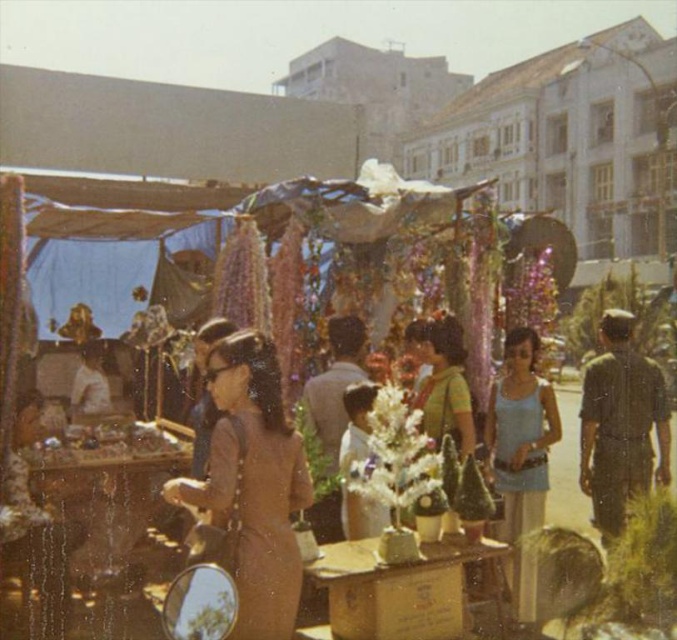
Can you confirm if dark green uniform at right is positioned to the left of green textured blouse at center?

In fact, dark green uniform at right is to the right of green textured blouse at center.

Which is behind, point (588, 461) or point (447, 428)?

The point (588, 461) is behind.

At what (x,y) coordinates should I click in order to perform the action: click on dark green uniform at right. Please return your answer as a coordinate pair (x, y). This screenshot has height=640, width=677. Looking at the image, I should click on [619, 424].

Which of these two, brown matte dress at center or green textured blouse at center, stands shorter?

With less height is green textured blouse at center.

Describe the element at coordinates (253, 483) in the screenshot. The image size is (677, 640). I see `brown matte dress at center` at that location.

Identify the location of brown matte dress at center. (253, 483).

Does dark green uniform at right have a lesser width compared to light blue tank top at center?

In fact, dark green uniform at right might be wider than light blue tank top at center.

Is dark green uniform at right to the left of light blue tank top at center from the viewer's perspective?

In fact, dark green uniform at right is to the right of light blue tank top at center.

Locate an element on the screen. This screenshot has width=677, height=640. dark green uniform at right is located at coordinates (619, 424).

The width and height of the screenshot is (677, 640). What are the coordinates of `dark green uniform at right` in the screenshot? It's located at (619, 424).